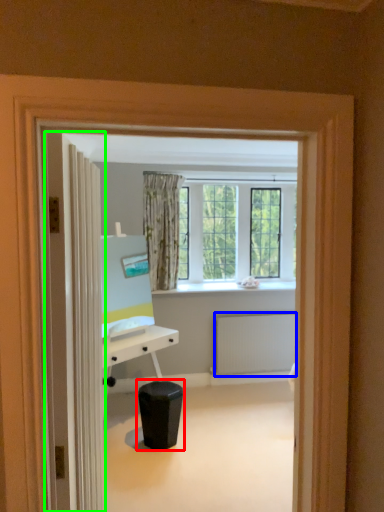
Question: Which object is the farthest from music stool (highlighted by a red box)? Choose among these: radiator (highlighted by a blue box) or door (highlighted by a green box).

Choices:
 (A) radiator
 (B) door

Answer: (B)